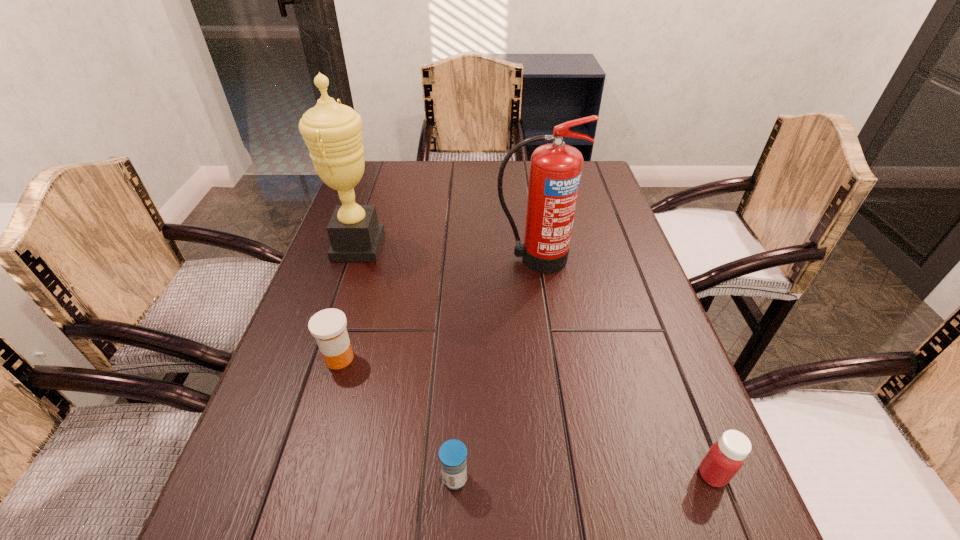
Find the location of a particular element. blank area located on the label of the farthest medicine is located at coordinates (413, 358).

At what (x,y) coordinates should I click in order to perform the action: click on vacant space located 0.210m on the back of the rightmost medicine. Please return your answer as a coordinate pair (x, y). Looking at the image, I should click on (668, 362).

Image resolution: width=960 pixels, height=540 pixels. In order to click on vacant space located on the right of the shortest medicine in this screenshot , I will do `click(534, 478)`.

This screenshot has width=960, height=540. I want to click on trophy cup situated at the left edge, so click(333, 132).

Where is `medicine situated at the left edge`? medicine situated at the left edge is located at coordinates (328, 326).

You are a GUI agent. You are given a task and a screenshot of the screen. Output one action in this format:
    pyautogui.click(x=<x>, y=<y>)
    Task: Click on the object that is positioned at the right edge
    The image size is (960, 540).
    Given the screenshot: What is the action you would take?
    pyautogui.click(x=724, y=459)

This screenshot has height=540, width=960. I want to click on vacant space at the far edge of the desktop, so click(436, 184).

In the image, there is a desktop. Find the location of `vacant space at the left edge`. vacant space at the left edge is located at coordinates (251, 444).

Where is `blank space at the right edge`? The width and height of the screenshot is (960, 540). blank space at the right edge is located at coordinates (669, 451).

Identify the location of vacant area that lies between the tallest object and the shortest medicine. This screenshot has width=960, height=540. (407, 362).